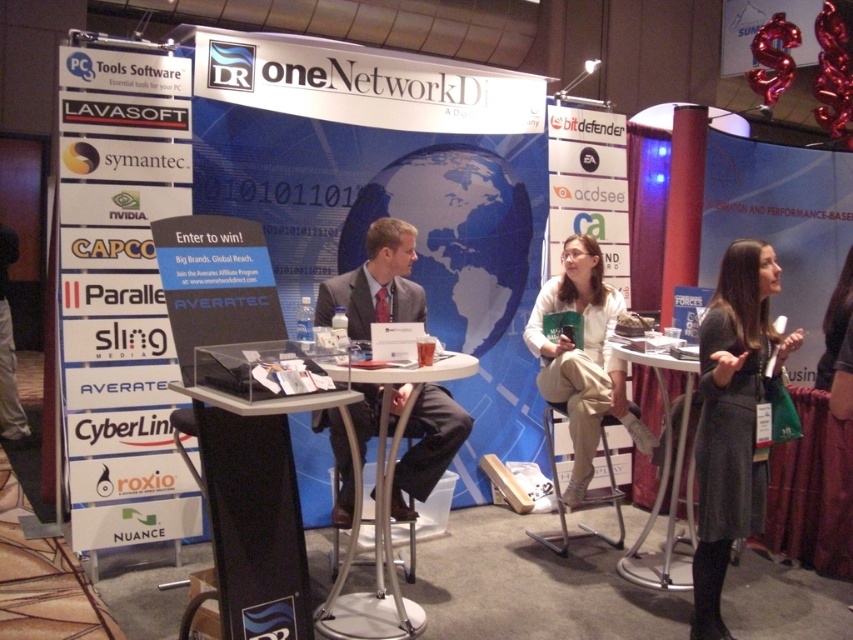
You are standing at the entrance of the trade show booth and notice the dark gray skirt at lower right. Where exactly is the dark gray skirt located in terms of coordinates?

The dark gray skirt at lower right is located at point (732, 419).

You are standing at the trade show booth and notice the dark gray skirt at lower right and the white plastic table at center. Which object is positioned higher from the ground?

The dark gray skirt at lower right is located above the white plastic table at center, so it is positioned higher from the ground.

You are standing at the point marked as point (704, 548) in the image. You want to take a photo of the camera in the scene. Is the camera within your reach to take a photo without moving from your current position?

The distance between point (704, 548) and the camera is 2.92 meters. Since the camera is 2.92 meters away, it is within a reasonable distance to take a photo without needing to move closer, assuming the camera has a functional lens. However, physically reaching the camera might not be possible, but capturing an image from that distance is feasible.